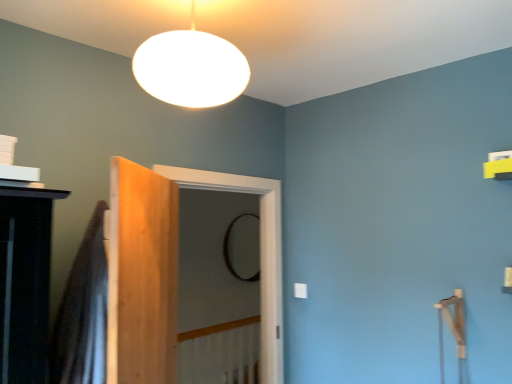
Question: Is light brown wood door at center taller than white matte/soft lampshade at upper center?

Choices:
 (A) no
 (B) yes

Answer: (B)

Question: Is white matte/soft lampshade at upper center located within light brown wood door at center?

Choices:
 (A) no
 (B) yes

Answer: (A)

Question: Considering the relative sizes of light brown wood door at center and white matte/soft lampshade at upper center in the image provided, is light brown wood door at center thinner than white matte/soft lampshade at upper center?

Choices:
 (A) no
 (B) yes

Answer: (B)

Question: From a real-world perspective, is light brown wood door at center located higher than white matte/soft lampshade at upper center?

Choices:
 (A) no
 (B) yes

Answer: (A)

Question: Does light brown wood door at center touch white matte/soft lampshade at upper center?

Choices:
 (A) no
 (B) yes

Answer: (A)

Question: Considering the positions of translucent fabric shower curtain at left and clear glass screen door at center in the image, is translucent fabric shower curtain at left wider or thinner than clear glass screen door at center?

Choices:
 (A) wide
 (B) thin

Answer: (A)

Question: Is translucent fabric shower curtain at left taller or shorter than clear glass screen door at center?

Choices:
 (A) short
 (B) tall

Answer: (A)

Question: Considering their positions, is translucent fabric shower curtain at left located in front of or behind clear glass screen door at center?

Choices:
 (A) front
 (B) behind

Answer: (A)

Question: Is translucent fabric shower curtain at left inside or outside of clear glass screen door at center?

Choices:
 (A) outside
 (B) inside

Answer: (A)

Question: Considering the positions of light brown wood door at center and translucent fabric shower curtain at left in the image, is light brown wood door at center bigger or smaller than translucent fabric shower curtain at left?

Choices:
 (A) big
 (B) small

Answer: (A)

Question: Do you think light brown wood door at center is within translucent fabric shower curtain at left, or outside of it?

Choices:
 (A) inside
 (B) outside

Answer: (B)

Question: Is point (146, 218) positioned closer to the camera than point (101, 288)?

Choices:
 (A) closer
 (B) farther

Answer: (B)

Question: Is light brown wood door at center in front of or behind translucent fabric shower curtain at left in the image?

Choices:
 (A) behind
 (B) front

Answer: (A)

Question: Would you say black glass mirror at center is to the left or to the right of white matte/soft lampshade at upper center in the picture?

Choices:
 (A) left
 (B) right

Answer: (B)

Question: Considering the positions of black glass mirror at center and white matte/soft lampshade at upper center in the image, is black glass mirror at center wider or thinner than white matte/soft lampshade at upper center?

Choices:
 (A) wide
 (B) thin

Answer: (B)